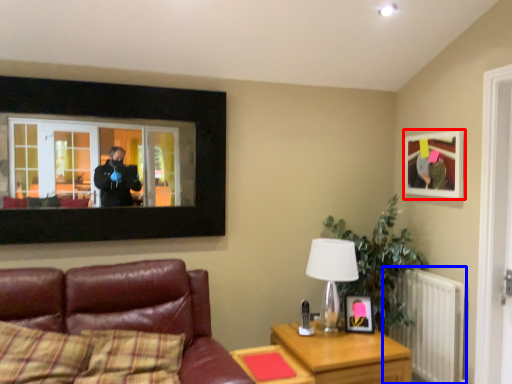
Question: Which object is further to the camera taking this photo, picture frame (highlighted by a red box) or radiator (highlighted by a blue box)?

Choices:
 (A) picture frame
 (B) radiator

Answer: (A)